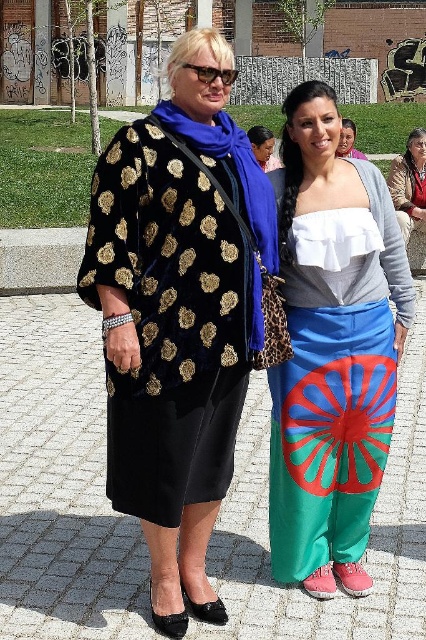
You are a photographer trying to capture a closeup of the velvet gold shawl at center and the matte brown leather jacket at upper right. Which item will appear larger in the photo?

The velvet gold shawl at center will appear larger in the photo because it is closer to the viewer than the matte brown leather jacket at upper right.